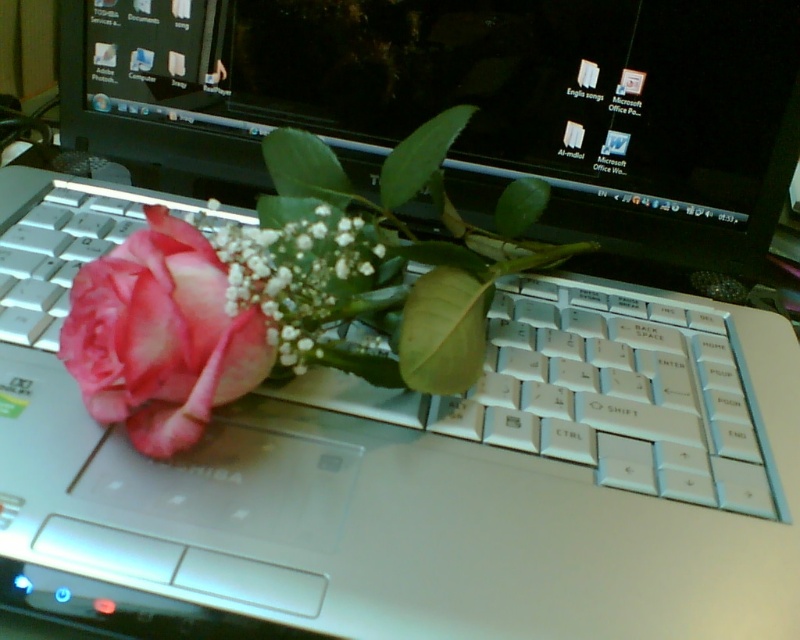
You are organizing the items on the laptop keyboard. You need to place both the pink matte rose at center and the matte pink rose at left so that they are aligned with the laptop screen. Which rose should you move to the left to make space?

The pink matte rose at center is to the right of the matte pink rose at left. To align them with the laptop screen, you should move the pink matte rose at center to the left to create space between them.

You are a graphic designer working on your Toshiba laptop. You need to place a pink matte rose at center in your design. However, you want to ensure it aligns with the position of the actual rose on your laptop keyboard. Can you confirm if the pink matte rose at center is located at point coordinates of [464,102]?

Yes, the pink matte rose at center is located at point coordinates of [464,102].

You are organizing a workspace and need to place both the matte pink rose at left and the pink matte flower at center on the laptop keyboard. Given their sizes, which one should you place first to ensure they both fit comfortably?

The matte pink rose at left is smaller than the pink matte flower at center, so you should place the pink matte flower at center first to accommodate its larger size, then the smaller matte pink rose at left will fit comfortably alongside it.